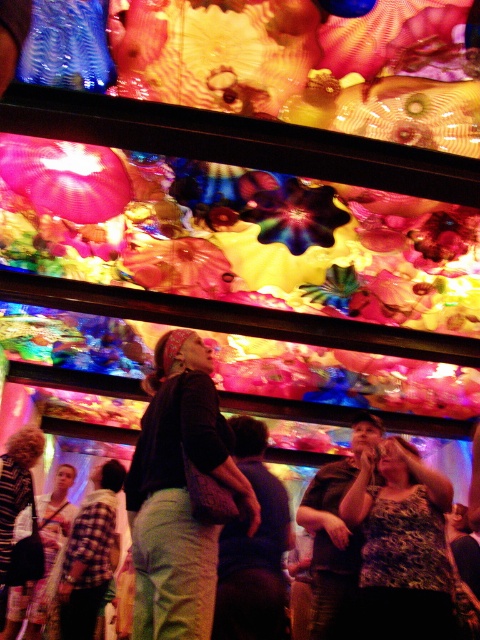
Does matte black shirt at center appear on the right side of leopard print tank top at center?

In fact, matte black shirt at center is to the left of leopard print tank top at center.

The image size is (480, 640). What do you see at coordinates (179, 493) in the screenshot?
I see `matte black shirt at center` at bounding box center [179, 493].

What are the coordinates of `matte black shirt at center` in the screenshot? It's located at (179, 493).